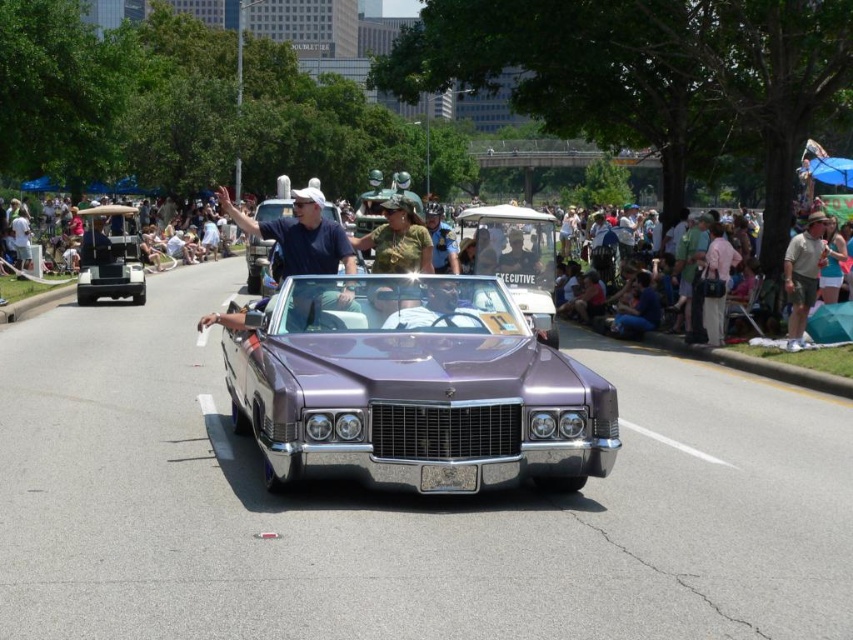
Question: Can you confirm if metallic blue shirt at center is positioned to the left of khaki cotton shirt at right?

Choices:
 (A) yes
 (B) no

Answer: (A)

Question: Estimate the real-world distances between objects in this image. Which object is closer to the khaki cotton shirt at right?

Choices:
 (A) metallic blue shirt at center
 (B) metallic purple car at center
 (C) purple metallic car at center

Answer: (A)

Question: Does metallic blue shirt at center come in front of khaki cotton shirt at right?

Choices:
 (A) no
 (B) yes

Answer: (B)

Question: Which is nearer to the metallic purple car at center?

Choices:
 (A) khaki cotton shirt at right
 (B) purple metallic car at center
 (C) metallic blue shirt at center

Answer: (C)

Question: Does metallic blue shirt at center come in front of khaki cotton shirt at right?

Choices:
 (A) no
 (B) yes

Answer: (B)

Question: Considering the real-world distances, which object is closest to the purple metallic car at center?

Choices:
 (A) metallic blue shirt at center
 (B) khaki cotton shirt at right
 (C) metallic purple car at center

Answer: (A)